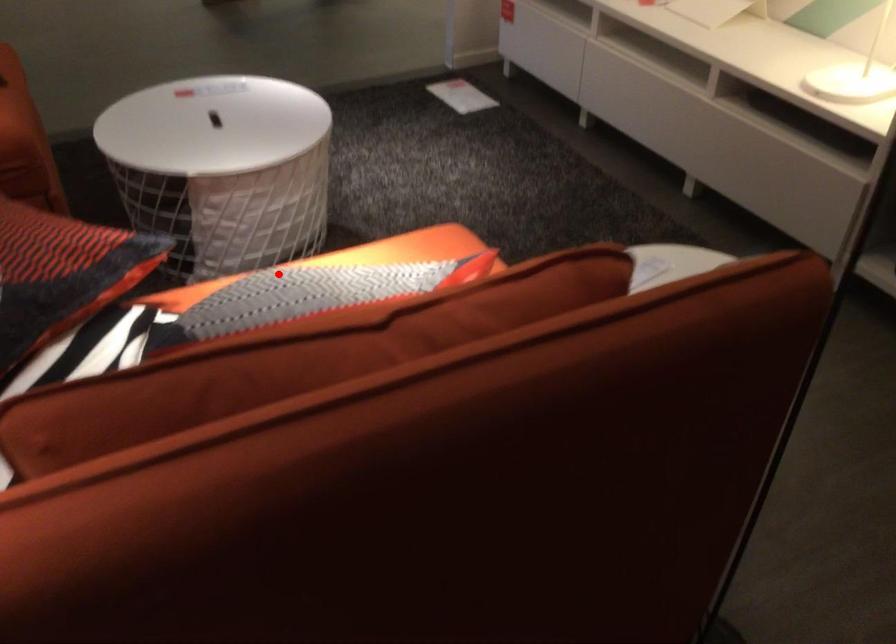
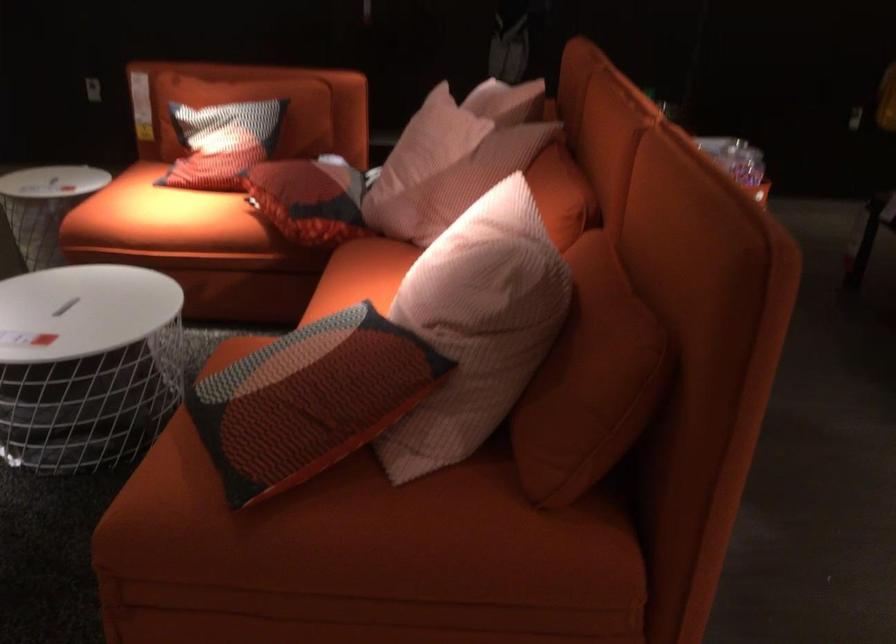
Question: I am providing you with two images of the same scene from different viewpoints. In image1, a red point is highlighted. Considering the same 3D point in image2, which of the following is correct?

Choices:
 (A) It is closer
 (B) It is farther

Answer: (B)